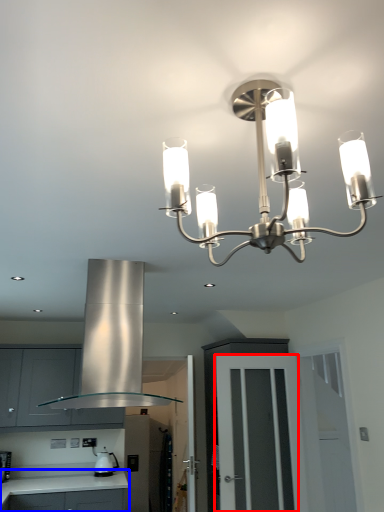
Question: Among these objects, which one is farthest to the camera, glass door (highlighted by a red box) or countertop (highlighted by a blue box)?

Choices:
 (A) glass door
 (B) countertop

Answer: (B)